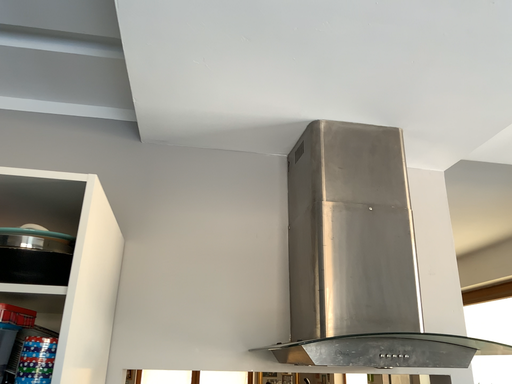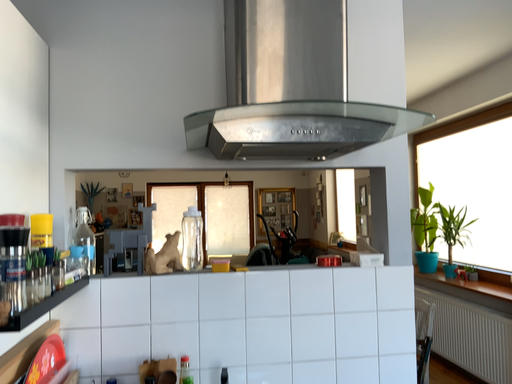
Question: Which way did the camera rotate in the video?

Choices:
 (A) rotated downward
 (B) rotated upward

Answer: (A)